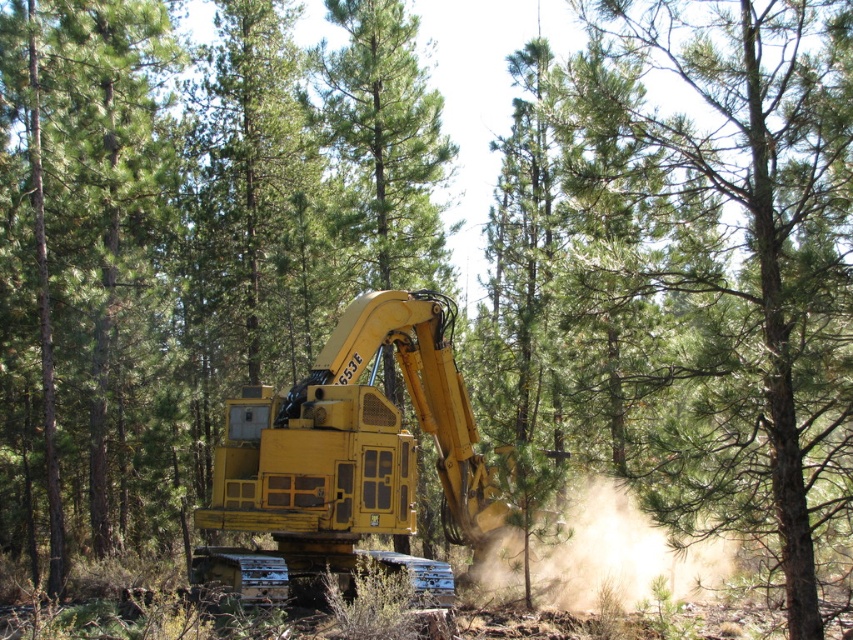
Is point (306, 493) farther from camera compared to point (587, 540)?

No, (306, 493) is in front of (587, 540).

Which is below, yellow metallic excavator at center or brown dusty cloud at center?

brown dusty cloud at center is below.

Is point (408, 480) positioned before point (618, 493)?

No, (408, 480) is behind (618, 493).

This screenshot has height=640, width=853. What are the coordinates of `yellow metallic excavator at center` in the screenshot? It's located at 350,449.

Who is positioned more to the right, green matte tree at center or brown dusty cloud at center?

brown dusty cloud at center

This screenshot has width=853, height=640. I want to click on green matte tree at center, so click(x=76, y=253).

Does green leafy tree at center have a greater width compared to yellow metallic excavator at center?

Yes, green leafy tree at center is wider than yellow metallic excavator at center.

Between green leafy tree at center and yellow metallic excavator at center, which one appears on the right side from the viewer's perspective?

green leafy tree at center is more to the right.

Which is in front, point (759, 394) or point (397, 310)?

Point (759, 394)

At what (x,y) coordinates should I click in order to perform the action: click on green leafy tree at center. Please return your answer as a coordinate pair (x, y). The width and height of the screenshot is (853, 640). Looking at the image, I should click on (740, 252).